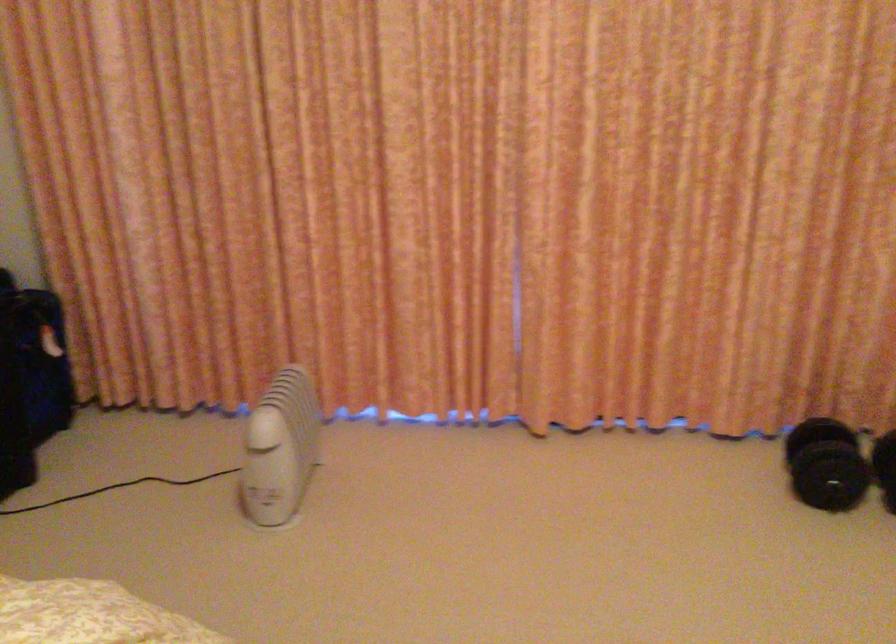
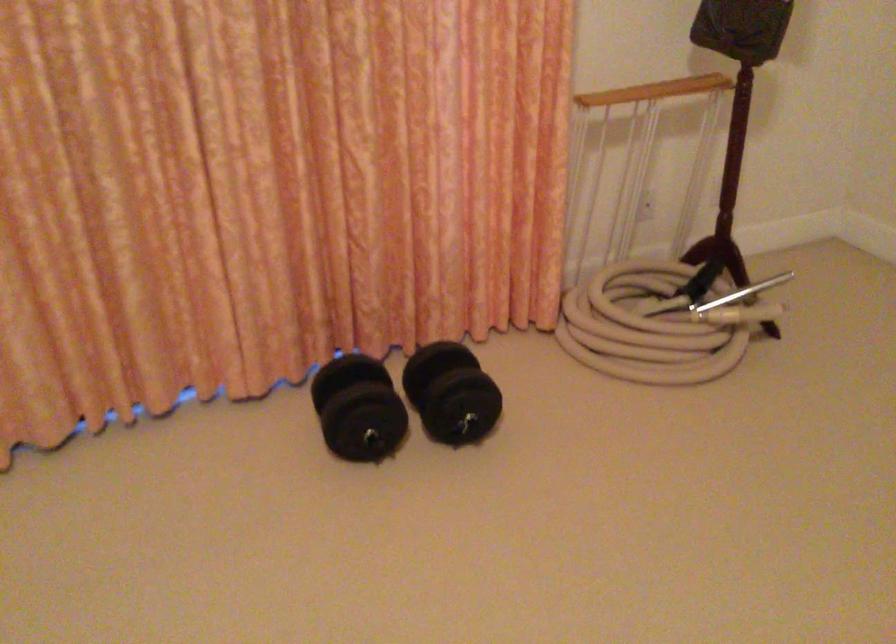
Question: Based on the continuous images, in which direction is the camera rotating? Reply with the corresponding letter.

Choices:
 (A) Left
 (B) Right
 (C) Up
 (D) Down

Answer: (B)